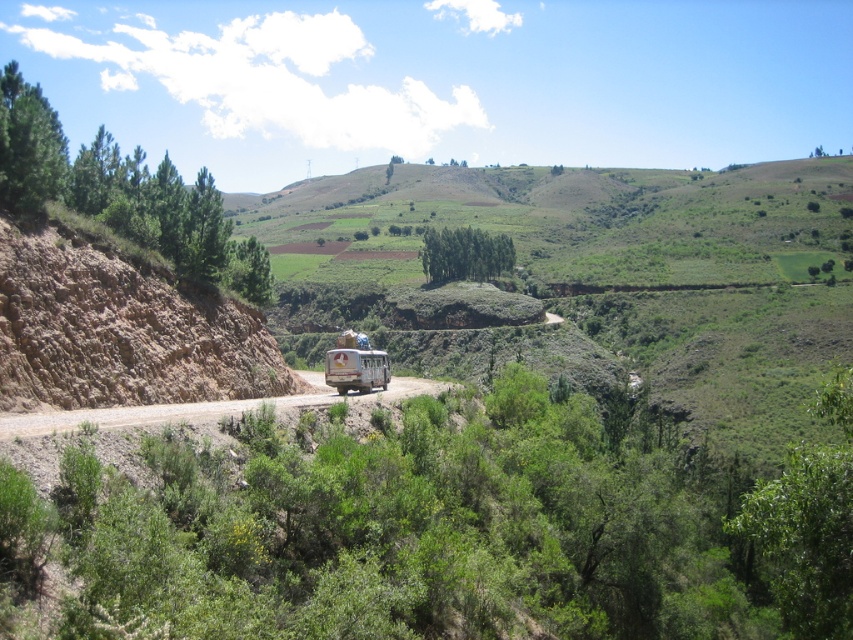
Question: Can you confirm if green leafy trees at left is positioned to the left of green matte tree at upper left?

Choices:
 (A) yes
 (B) no

Answer: (B)

Question: Can you confirm if dirt road at center is positioned below green leafy trees at center?

Choices:
 (A) yes
 (B) no

Answer: (A)

Question: Which object is closer to the camera taking this photo?

Choices:
 (A) green leafy trees at center
 (B) green leafy tree at center

Answer: (B)

Question: Among these points, which one is farthest from the camera?

Choices:
 (A) (22, 412)
 (B) (19, 81)
 (C) (10, 259)

Answer: (B)

Question: Estimate the real-world distances between objects in this image. Which object is farther from the green leafy tree at center?

Choices:
 (A) green leafy trees at left
 (B) dirt road at center

Answer: (A)

Question: Is green matte tree at upper left bigger than green leafy tree at left?

Choices:
 (A) yes
 (B) no

Answer: (A)